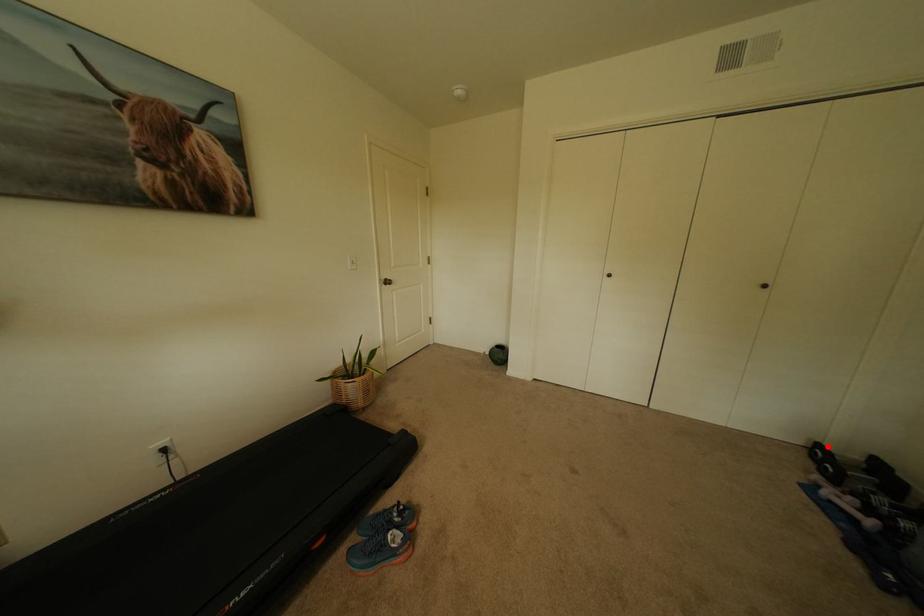
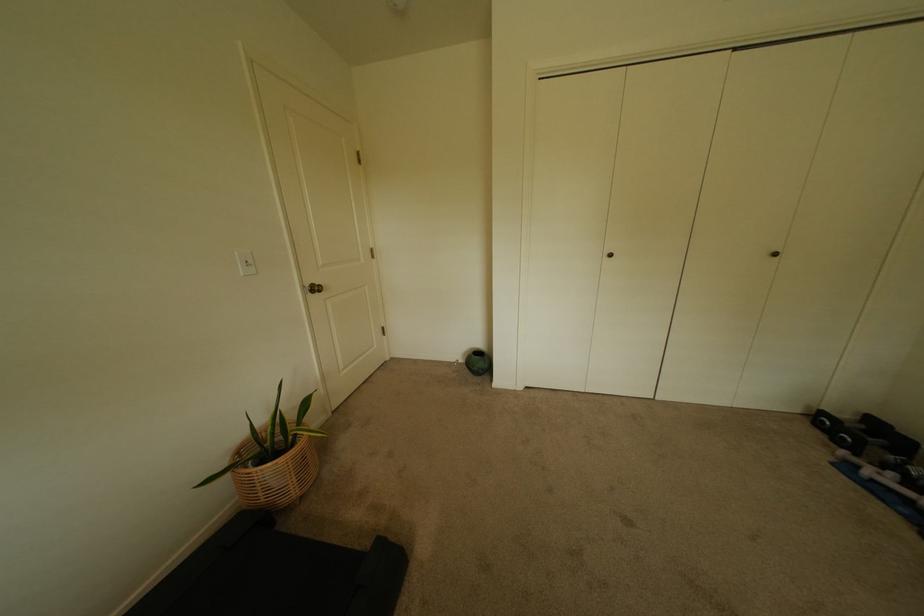
Find the pixel in the second image that matches the highlighted location in the first image.

(831, 415)